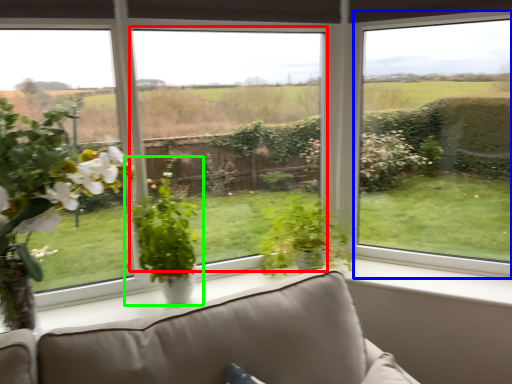
Question: Based on their relative distances, which object is nearer to window screen (highlighted by a red box)? Choose from window (highlighted by a blue box) and houseplant (highlighted by a green box).

Choices:
 (A) window
 (B) houseplant

Answer: (B)